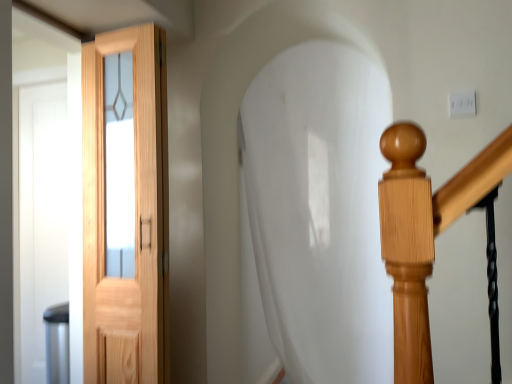
Identify the location of natural wood door at left. The image size is (512, 384). (135, 219).

What do you see at coordinates (135, 219) in the screenshot?
I see `natural wood door at left` at bounding box center [135, 219].

Where is `natural wood door at left`? Image resolution: width=512 pixels, height=384 pixels. natural wood door at left is located at coordinates (135, 219).